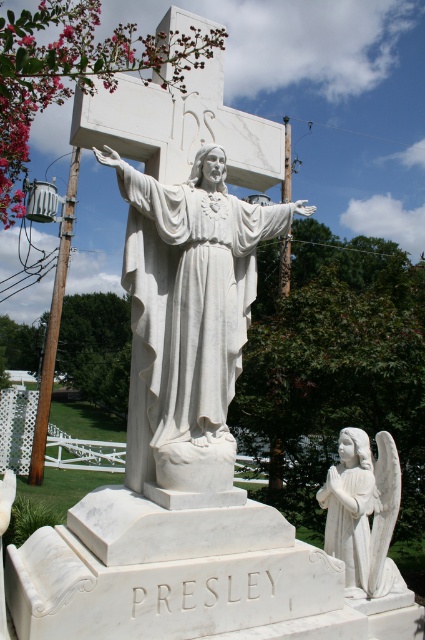
Does white marble statue at center appear on the left side of white marble angel at lower right?

Correct, you'll find white marble statue at center to the left of white marble angel at lower right.

This screenshot has height=640, width=425. What are the coordinates of `white marble statue at center` in the screenshot? It's located at (187, 323).